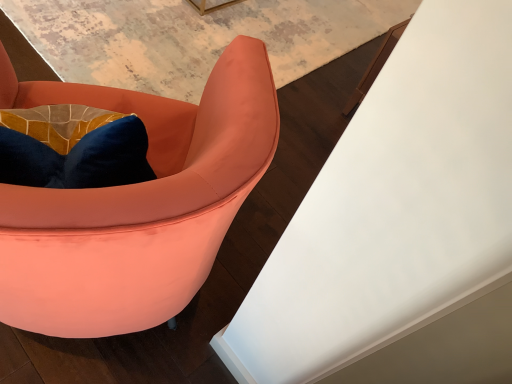
Question: From the image's perspective, is satin peach armchair at left located above white glossy table at upper right?

Choices:
 (A) no
 (B) yes

Answer: (A)

Question: Considering the relative sizes of satin peach armchair at left and white glossy table at upper right in the image provided, is satin peach armchair at left bigger than white glossy table at upper right?

Choices:
 (A) no
 (B) yes

Answer: (B)

Question: Is satin peach armchair at left positioned beyond the bounds of white glossy table at upper right?

Choices:
 (A) yes
 (B) no

Answer: (A)

Question: Does satin peach armchair at left lie behind white glossy table at upper right?

Choices:
 (A) yes
 (B) no

Answer: (B)

Question: From a real-world perspective, is satin peach armchair at left physically above white glossy table at upper right?

Choices:
 (A) no
 (B) yes

Answer: (B)

Question: Considering the relative sizes of satin peach armchair at left and white glossy table at upper right in the image provided, is satin peach armchair at left thinner than white glossy table at upper right?

Choices:
 (A) yes
 (B) no

Answer: (A)

Question: Considering the relative sizes of white glossy table at upper right and satin peach armchair at left in the image provided, is white glossy table at upper right thinner than satin peach armchair at left?

Choices:
 (A) yes
 (B) no

Answer: (B)

Question: Does white glossy table at upper right have a smaller size compared to satin peach armchair at left?

Choices:
 (A) yes
 (B) no

Answer: (A)

Question: Can you confirm if white glossy table at upper right is positioned to the left of satin peach armchair at left?

Choices:
 (A) no
 (B) yes

Answer: (A)

Question: Does white glossy table at upper right come behind satin peach armchair at left?

Choices:
 (A) no
 (B) yes

Answer: (B)

Question: Is white glossy table at upper right facing away from satin peach armchair at left?

Choices:
 (A) yes
 (B) no

Answer: (B)

Question: From a real-world perspective, is white glossy table at upper right located higher than satin peach armchair at left?

Choices:
 (A) yes
 (B) no

Answer: (B)

Question: Considering the positions of point (450, 14) and point (131, 256), is point (450, 14) closer or farther from the camera than point (131, 256)?

Choices:
 (A) farther
 (B) closer

Answer: (B)